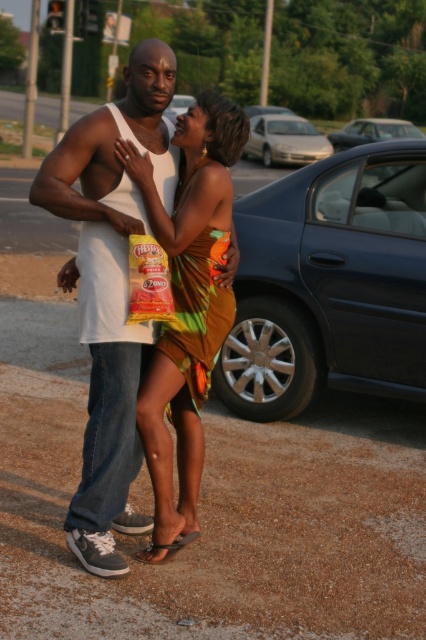
Who is taller, shiny orange dress at center or silver metallic sedan at center?

Standing taller between the two is silver metallic sedan at center.

Does shiny orange dress at center appear under silver metallic sedan at center?

Yes, shiny orange dress at center is below silver metallic sedan at center.

Does point (236, 113) come closer to viewer compared to point (291, 120)?

Yes, point (236, 113) is in front of point (291, 120).

Where is `shiny orange dress at center`? The height and width of the screenshot is (640, 426). shiny orange dress at center is located at coordinates (187, 307).

Is metallic blue sedan at right below shiny orange dress at center?

No.

What do you see at coordinates (330, 284) in the screenshot? I see `metallic blue sedan at right` at bounding box center [330, 284].

Where is `metallic blue sedan at right`? This screenshot has height=640, width=426. metallic blue sedan at right is located at coordinates (330, 284).

Can you confirm if metallic blue sedan at center is positioned below blue metallic car at center?

Incorrect, metallic blue sedan at center is not positioned below blue metallic car at center.

Is point (419, 134) less distant than point (173, 116)?

That is False.

Find the location of a particular element. This screenshot has height=640, width=426. metallic blue sedan at center is located at coordinates (373, 131).

The image size is (426, 640). In order to click on metallic blue sedan at center in this screenshot , I will do `click(373, 131)`.